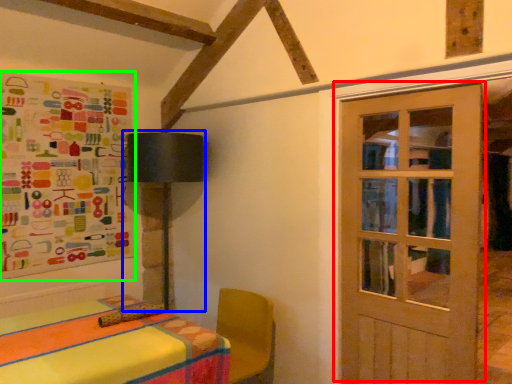
Question: Which object is the farthest from door (highlighted by a red box)? Choose among these: table lamp (highlighted by a blue box) or bulletin board (highlighted by a green box).

Choices:
 (A) table lamp
 (B) bulletin board

Answer: (B)